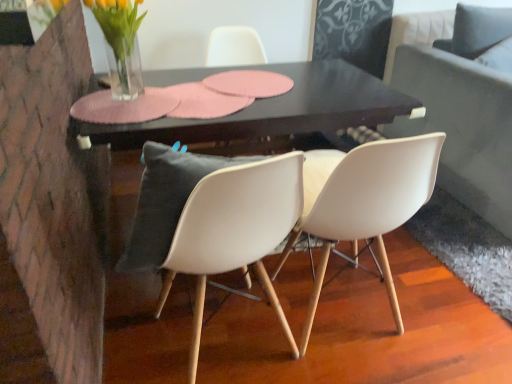
I want to click on vacant area situated below white matte chair at center, which is counted as the 2th chair, starting from the front (from a real-world perspective), so click(343, 313).